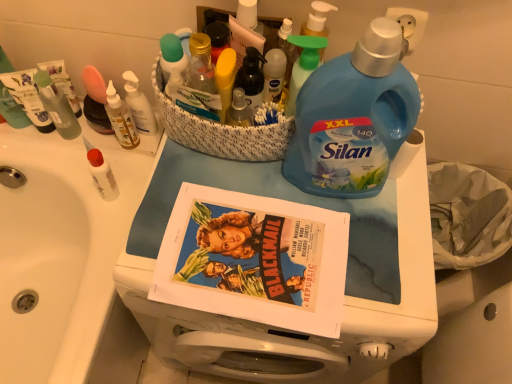
Image resolution: width=512 pixels, height=384 pixels. What are the coordinates of `free location in front of white plastic bottle at upper left, which ranks as the second toiletry in right-to-left order` in the screenshot? It's located at (120, 183).